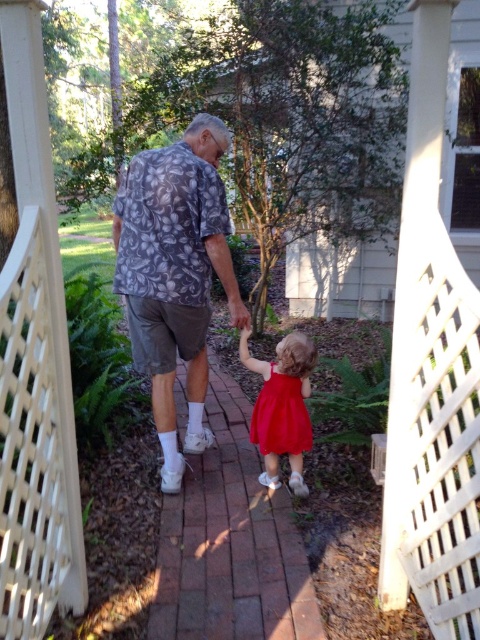
Is floral fabric shirt at center below matte red dress at center?

Incorrect, floral fabric shirt at center is not positioned below matte red dress at center.

Does point (171, 198) come closer to viewer compared to point (257, 417)?

Yes, it is.

Locate an element on the screen. The height and width of the screenshot is (640, 480). floral fabric shirt at center is located at coordinates (175, 273).

Who is higher up, red satin dress at center or floral fabric shirt at center?

Positioned higher is floral fabric shirt at center.

Image resolution: width=480 pixels, height=640 pixels. Find the location of `red satin dress at center`. red satin dress at center is located at coordinates (230, 541).

Locate an element on the screen. This screenshot has width=480, height=640. red satin dress at center is located at coordinates (230, 541).

This screenshot has height=640, width=480. Find the location of `red satin dress at center`. red satin dress at center is located at coordinates (230, 541).

Find the location of a particular element. The width and height of the screenshot is (480, 640). red satin dress at center is located at coordinates (230, 541).

Is red satin dress at center shorter than matte red dress at center?

Indeed, red satin dress at center has a lesser height compared to matte red dress at center.

Who is more distant from viewer, (216,544) or (300,403)?

The point (300,403) is behind.

Image resolution: width=480 pixels, height=640 pixels. In order to click on red satin dress at center in this screenshot , I will do pos(230,541).